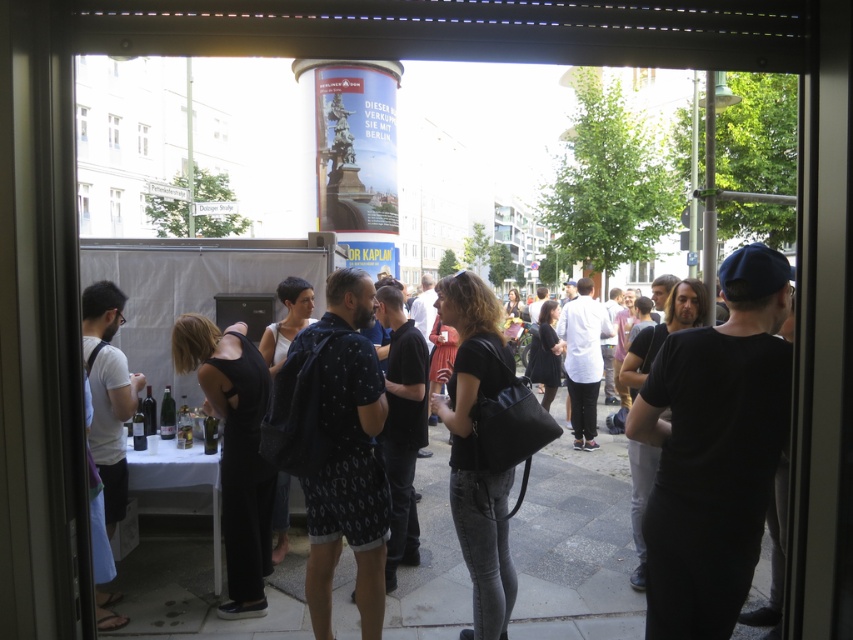
Question: Based on their relative distances, which object is nearer to the black matte jumpsuit at lower left?

Choices:
 (A) smooth concrete pavement at center
 (B) black matte shirt at center

Answer: (B)

Question: Which is farther from the black matte shirt at center?

Choices:
 (A) black matte jumpsuit at lower left
 (B) smooth concrete pavement at center

Answer: (B)

Question: In this image, where is black matte shirt at center located relative to black matte jumpsuit at lower left?

Choices:
 (A) right
 (B) left

Answer: (A)

Question: Which point is farther to the camera?

Choices:
 (A) (490, 612)
 (B) (262, 563)
 (C) (155, 604)

Answer: (B)

Question: Observing the image, what is the correct spatial positioning of smooth concrete pavement at center in reference to black matte shirt at center?

Choices:
 (A) right
 (B) left

Answer: (A)

Question: Does black matte shirt at center have a lesser width compared to black matte jumpsuit at lower left?

Choices:
 (A) yes
 (B) no

Answer: (A)